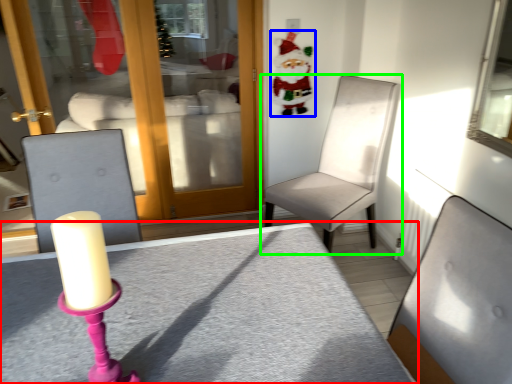
Question: Which object is positioned farthest from table (highlighted by a red box)? Select from santa claus (highlighted by a blue box) and chair (highlighted by a green box).

Choices:
 (A) santa claus
 (B) chair

Answer: (A)